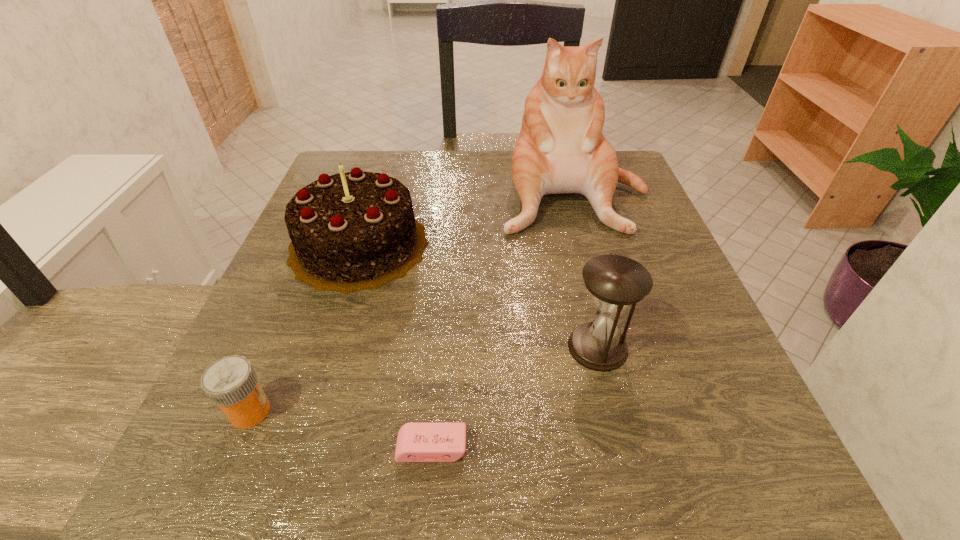
I want to click on vacant area between the eraser and the birthday cake, so click(x=396, y=346).

I want to click on free space between the second nearest object and the tallest object, so click(412, 302).

Locate an element on the screen. The height and width of the screenshot is (540, 960). free point between the birthday cake and the hourglass is located at coordinates (478, 296).

Find the location of `free space between the birthday cake and the shortest object`. free space between the birthday cake and the shortest object is located at coordinates (396, 346).

Identify which object is located as the third nearest to the third tallest object. Please provide its 2D coordinates. Your answer should be formatted as a tuple, i.e. [(x, y)], where the tuple contains the x and y coordinates of a point satisfying the conditions above.

[(353, 231)]

Locate which object is the second closest to the second tallest object. Please provide its 2D coordinates. Your answer should be formatted as a tuple, i.e. [(x, y)], where the tuple contains the x and y coordinates of a point satisfying the conditions above.

[(231, 382)]

Identify the location of free space that satisfies the following two spatial constraints: 1. on the front side of the shortest object; 2. on the left side of the fourth shortest object. (294, 448).

Locate an element on the screen. The height and width of the screenshot is (540, 960). vacant area that satisfies the following two spatial constraints: 1. on the face of the tallest object; 2. on the label side of the second shortest object is located at coordinates (635, 411).

At what (x,y) coordinates should I click in order to perform the action: click on free location that satisfies the following two spatial constraints: 1. on the front side of the nearest object; 2. on the right side of the second tallest object. Please return your answer as a coordinate pair (x, y). This screenshot has width=960, height=540. Looking at the image, I should click on (294, 448).

Where is `vacant point that satisfies the following two spatial constraints: 1. on the face of the cat; 2. on the label side of the medicine`? vacant point that satisfies the following two spatial constraints: 1. on the face of the cat; 2. on the label side of the medicine is located at coordinates (635, 411).